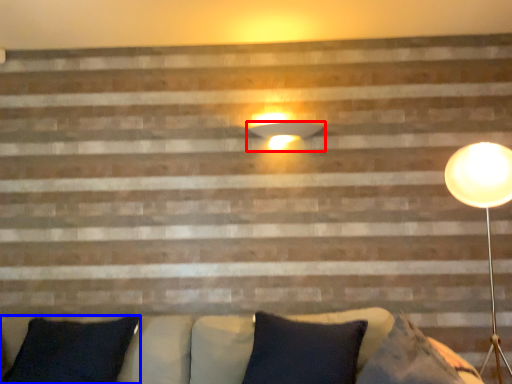
Question: Among these objects, which one is nearest to the camera, lamp (highlighted by a red box) or pillow (highlighted by a blue box)?

Choices:
 (A) lamp
 (B) pillow

Answer: (B)